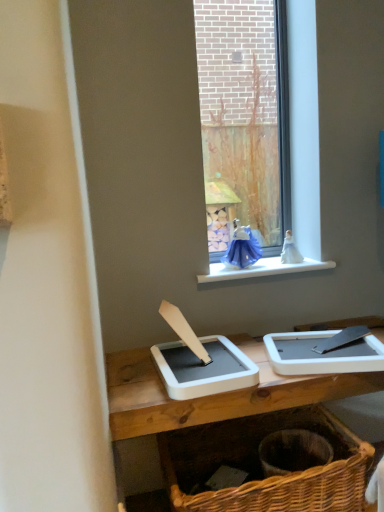
Question: Is blue glass window at center bigger or smaller than woven brown basket at lower right?

Choices:
 (A) small
 (B) big

Answer: (A)

Question: Visually, is blue glass window at center positioned to the left or to the right of woven brown basket at lower right?

Choices:
 (A) left
 (B) right

Answer: (B)

Question: Which object is positioned farthest from the white plastic window sill at upper center?

Choices:
 (A) blue glass window at center
 (B) woven brown basket at lower right

Answer: (B)

Question: Which of these objects is positioned farthest from the blue glass window at center?

Choices:
 (A) white plastic window sill at upper center
 (B) woven brown basket at lower right

Answer: (B)